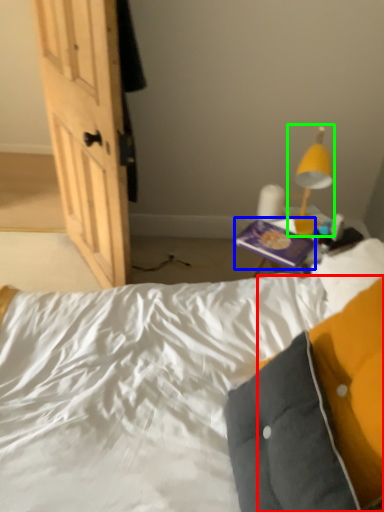
Question: Estimate the real-world distances between objects in this image. Which object is farther from pillow (highlighted by a red box), paperback book (highlighted by a blue box) or lamp (highlighted by a green box)?

Choices:
 (A) paperback book
 (B) lamp

Answer: (B)